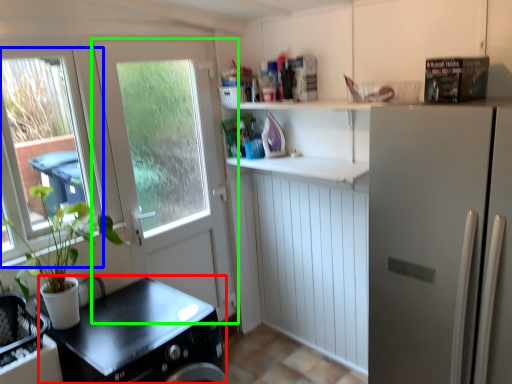
Question: Considering the real-world distances, which object is closest to counter top (highlighted by a red box)? window (highlighted by a blue box) or door (highlighted by a green box).

Choices:
 (A) window
 (B) door

Answer: (B)